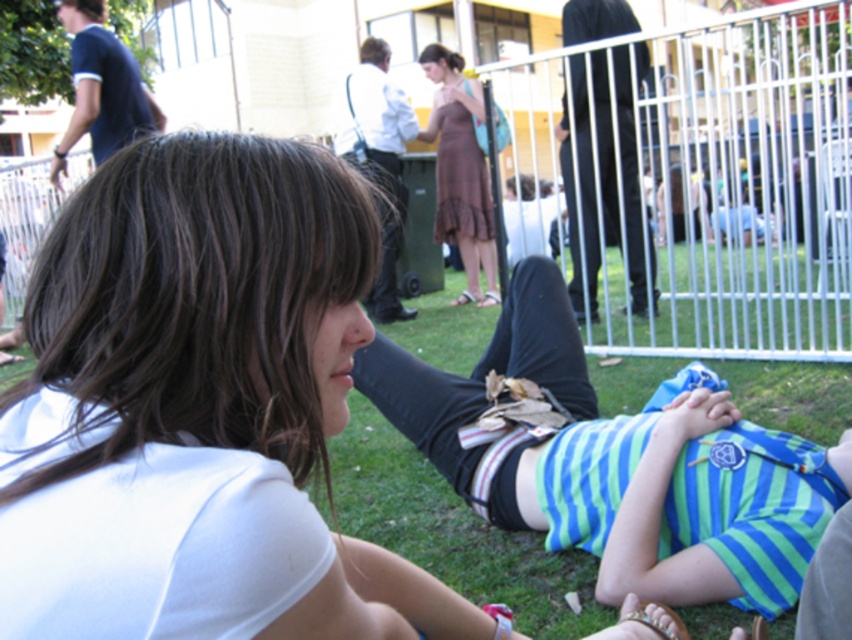
You are organizing a clothing display and need to place the white matte shirt at center and the brown dress at center side by side. Based on their widths, which one should be placed on the left to ensure they fit within a 1.5 meter wide display rack?

The white matte shirt at center is wider than the brown dress at center. To fit them side by side on a 1.5 meter wide rack, place the narrower brown dress at center on the left and the wider white matte shirt at center on the right, ensuring the total width does not exceed the rack.

You are a photographer trying to capture a photo of both the white matte shirt at center and the brown dress at center. Since you want to ensure both are visible, which one should you focus on first to make sure it is in frame?

The white matte shirt at center is below the brown dress at center, so you should focus on the brown dress at center first to ensure it stays in frame as it is higher up.